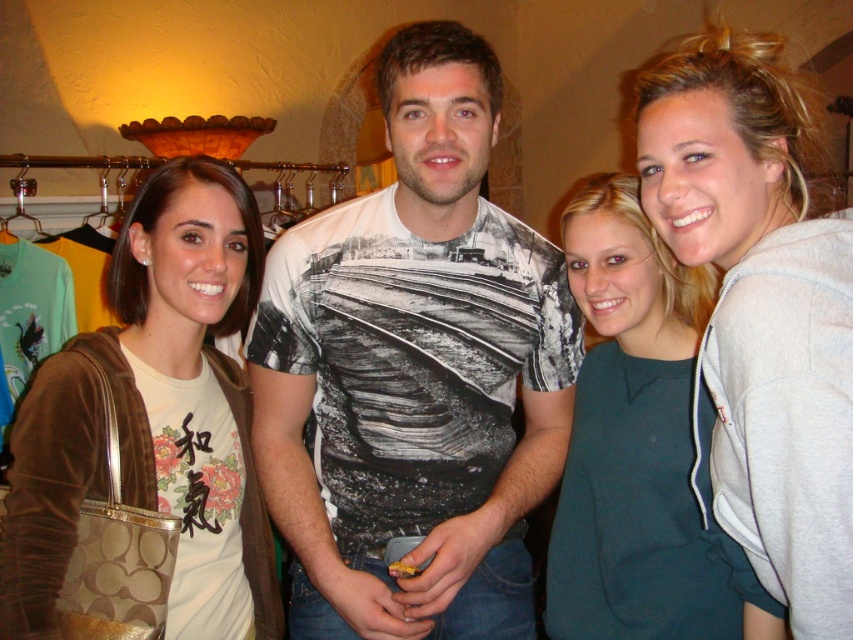
Question: Which point appears farthest from the camera in this image?

Choices:
 (A) (209, 477)
 (B) (643, 602)
 (C) (712, 435)
 (D) (265, 445)

Answer: (D)

Question: Does white printed t-shirt at center appear on the left side of teal matte dress at center?

Choices:
 (A) yes
 (B) no

Answer: (A)

Question: Based on their relative distances, which object is farther from the teal matte dress at center?

Choices:
 (A) white printed t-shirt at center
 (B) gray fleece sweatshirt at right

Answer: (B)

Question: Which is nearer to the teal matte dress at center?

Choices:
 (A) white printed t-shirt at center
 (B) gray fleece sweatshirt at right

Answer: (A)

Question: Can you confirm if white printed t-shirt at center is positioned above gray fleece sweatshirt at right?

Choices:
 (A) yes
 (B) no

Answer: (B)

Question: Does brown suede jacket at left have a smaller size compared to teal matte dress at center?

Choices:
 (A) yes
 (B) no

Answer: (B)